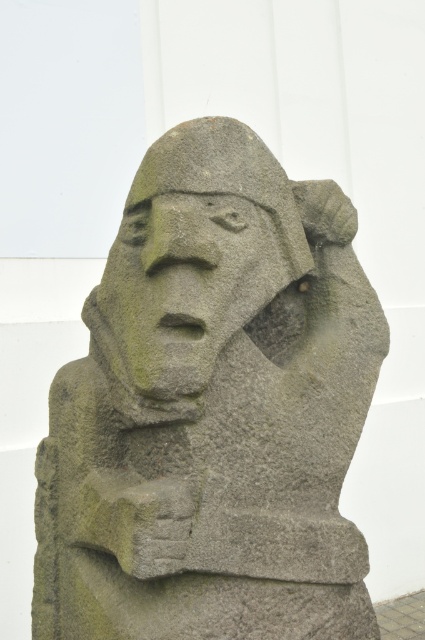
Question: Does gray stone statue at center have a greater width compared to green stone face at center?

Choices:
 (A) yes
 (B) no

Answer: (A)

Question: Among these objects, which one is farthest from the camera?

Choices:
 (A) gray stone statue at center
 (B) green stone face at center

Answer: (B)

Question: Can you confirm if gray stone statue at center is bigger than green stone face at center?

Choices:
 (A) yes
 (B) no

Answer: (A)

Question: Does gray stone statue at center appear on the left side of green stone face at center?

Choices:
 (A) no
 (B) yes

Answer: (A)